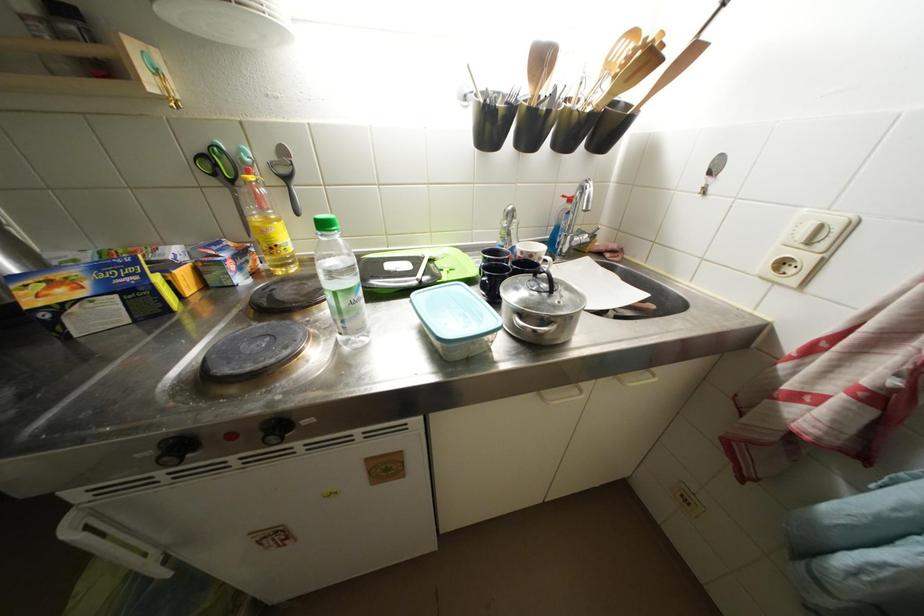
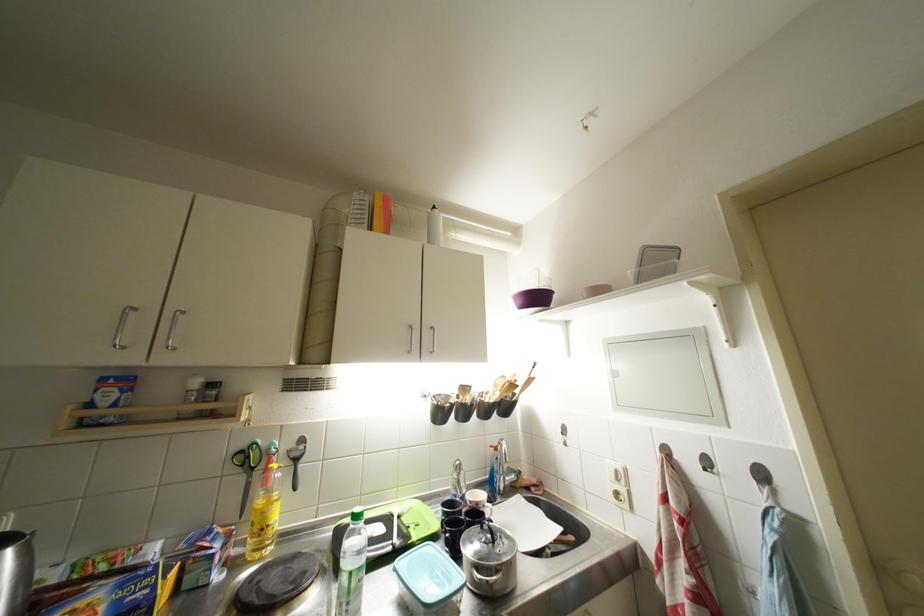
Locate, in the second image, the point that corresponds to (x=349, y=309) in the first image.

(359, 589)